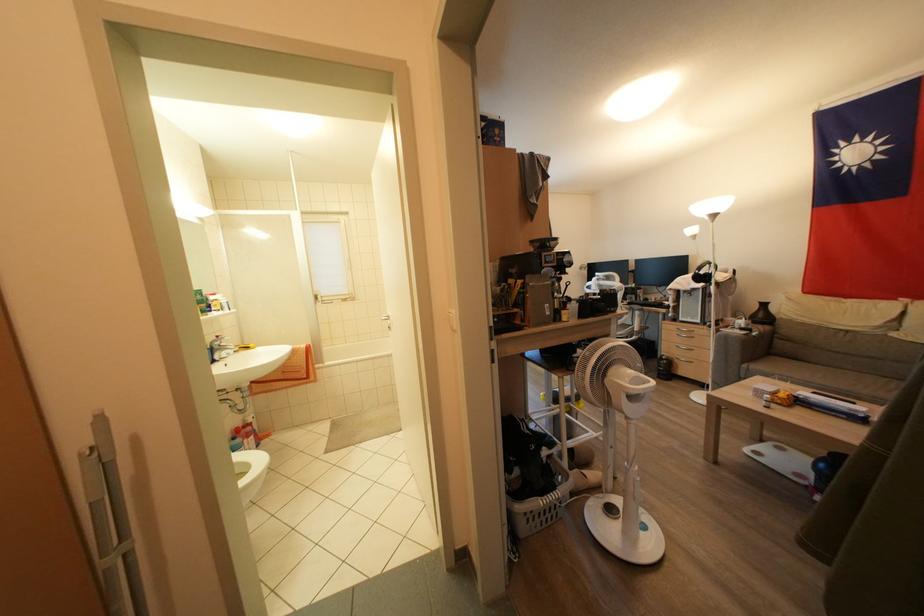
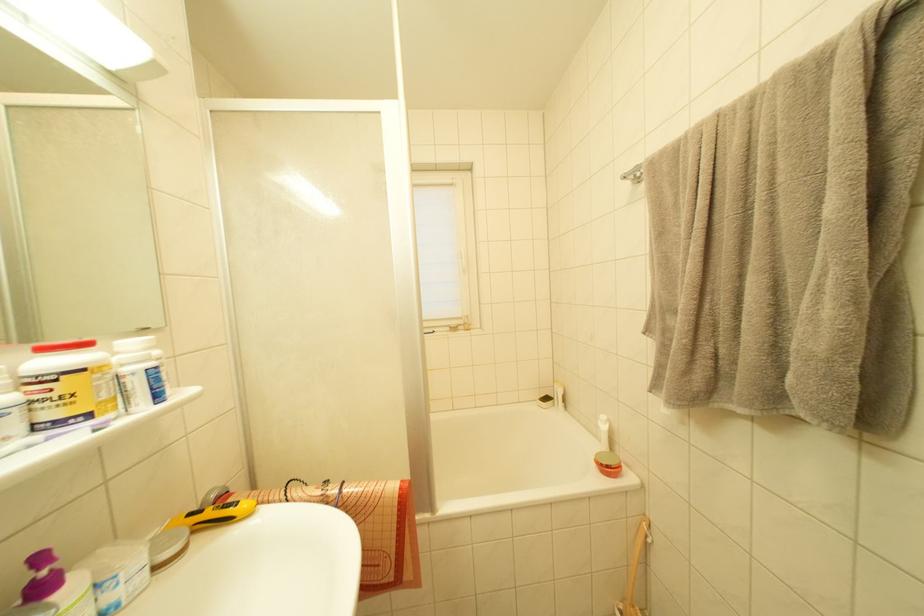
In the second image, find the point that corresponds to [207,223] in the first image.

(127, 84)